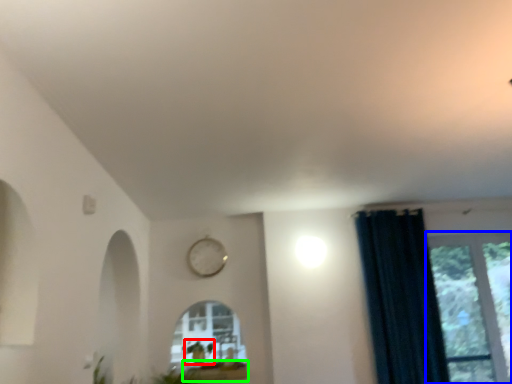
Question: Estimate the real-world distances between objects in this image. Which object is closer to plant (highlighted by a red box), window (highlighted by a blue box) or window sill (highlighted by a green box)?

Choices:
 (A) window
 (B) window sill

Answer: (B)